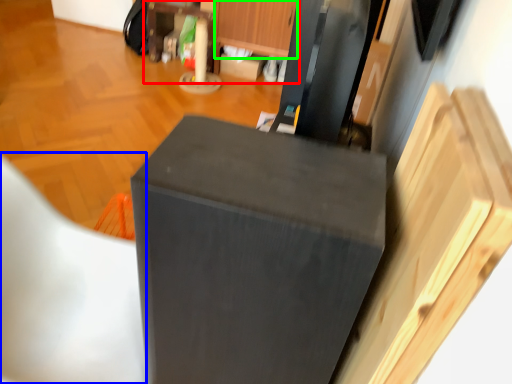
Question: Considering the real-world distances, which object is farthest from dresser (highlighted by a red box)? folding chair (highlighted by a blue box) or drawer (highlighted by a green box)?

Choices:
 (A) folding chair
 (B) drawer

Answer: (A)